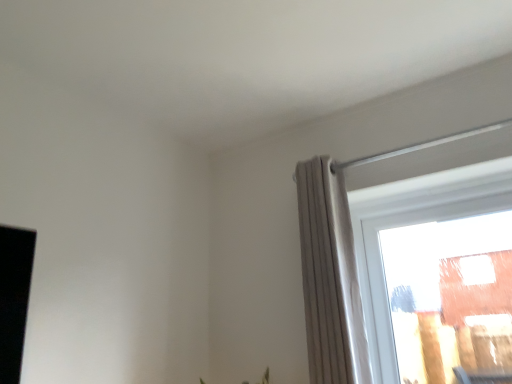
Question: Can you confirm if light gray pleated curtain at right is taller than transparent glass window at upper right?

Choices:
 (A) no
 (B) yes

Answer: (B)

Question: Is light gray pleated curtain at right in front of transparent glass window at upper right?

Choices:
 (A) no
 (B) yes

Answer: (B)

Question: From the image's perspective, is light gray pleated curtain at right beneath transparent glass window at upper right?

Choices:
 (A) no
 (B) yes

Answer: (A)

Question: From a real-world perspective, is light gray pleated curtain at right physically below transparent glass window at upper right?

Choices:
 (A) yes
 (B) no

Answer: (B)

Question: Is light gray pleated curtain at right facing away from transparent glass window at upper right?

Choices:
 (A) yes
 (B) no

Answer: (B)

Question: Can you confirm if light gray pleated curtain at right is positioned to the left of transparent glass window at upper right?

Choices:
 (A) no
 (B) yes

Answer: (B)

Question: From the image's perspective, is transparent glass window at upper right above light gray pleated curtain at right?

Choices:
 (A) no
 (B) yes

Answer: (A)

Question: From a real-world perspective, is transparent glass window at upper right positioned under light gray pleated curtain at right based on gravity?

Choices:
 (A) no
 (B) yes

Answer: (B)

Question: Is transparent glass window at upper right not near light gray pleated curtain at right?

Choices:
 (A) no
 (B) yes

Answer: (A)

Question: From the image's perspective, does transparent glass window at upper right appear lower than light gray pleated curtain at right?

Choices:
 (A) yes
 (B) no

Answer: (A)

Question: Is transparent glass window at upper right looking in the opposite direction of light gray pleated curtain at right?

Choices:
 (A) no
 (B) yes

Answer: (A)

Question: Can you confirm if transparent glass window at upper right is smaller than light gray pleated curtain at right?

Choices:
 (A) no
 (B) yes

Answer: (B)

Question: Is light gray pleated curtain at right bigger or smaller than transparent glass window at upper right?

Choices:
 (A) big
 (B) small

Answer: (A)